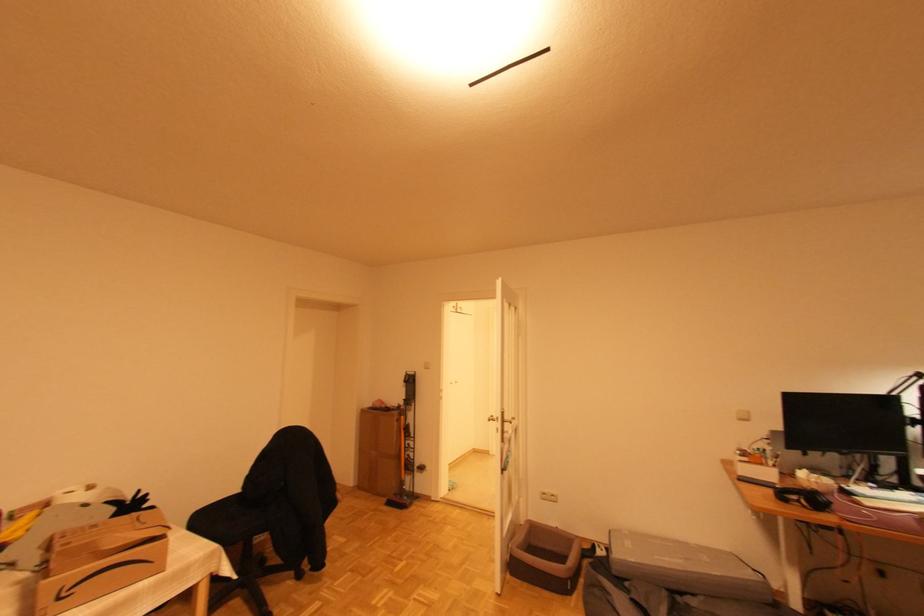
What do you see at coordinates (227, 521) in the screenshot?
I see `the black chair sitting surface` at bounding box center [227, 521].